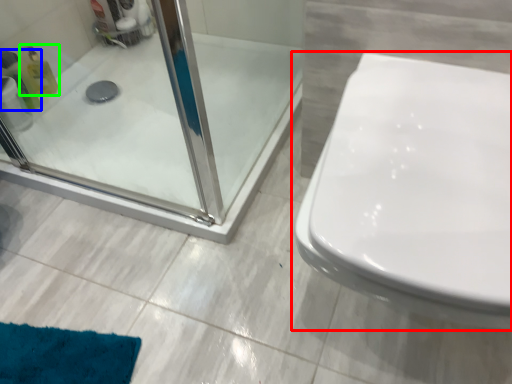
Question: Which object is positioned closest to toilet (highlighted by a red box)? Select from cleaning product (highlighted by a blue box) and cleaning product (highlighted by a green box).

Choices:
 (A) cleaning product
 (B) cleaning product

Answer: (A)